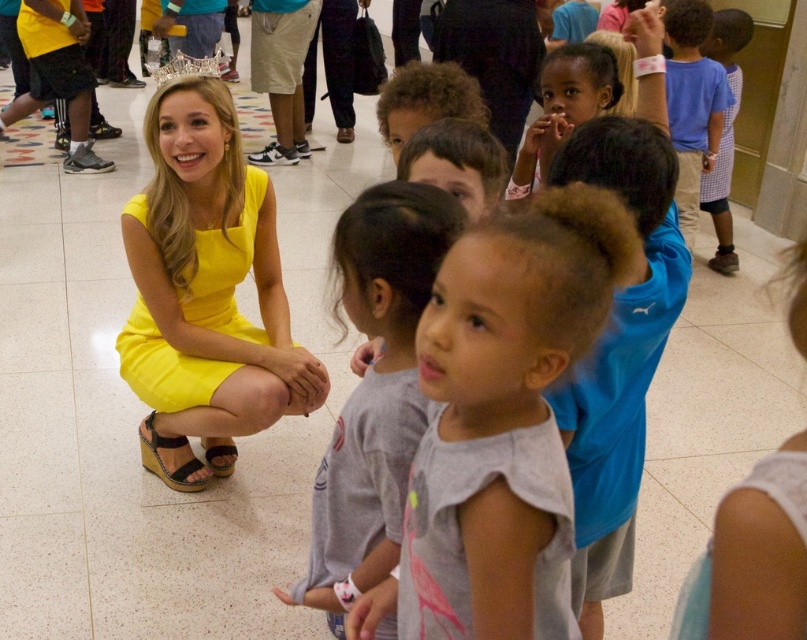
Question: Does gray cotton shirt at center lie behind yellow matte dress at center?

Choices:
 (A) no
 (B) yes

Answer: (A)

Question: Can you confirm if yellow matte dress at center is wider than clear crystal crown at upper center?

Choices:
 (A) yes
 (B) no

Answer: (A)

Question: Which object is closer to the camera taking this photo?

Choices:
 (A) yellow satin dress at center
 (B) gray cotton shirt at center
 (C) clear crystal crown at upper center
 (D) yellow matte dress at center

Answer: (B)

Question: Does gray cotton shirt at center have a lesser width compared to clear crystal crown at upper center?

Choices:
 (A) yes
 (B) no

Answer: (A)

Question: Estimate the real-world distances between objects in this image. Which object is farther from the yellow matte dress at center?

Choices:
 (A) gray cotton shirt at center
 (B) clear crystal crown at upper center
 (C) yellow satin dress at center

Answer: (A)

Question: Which point appears farthest from the camera in this image?

Choices:
 (A) (216, 177)
 (B) (400, 262)

Answer: (A)